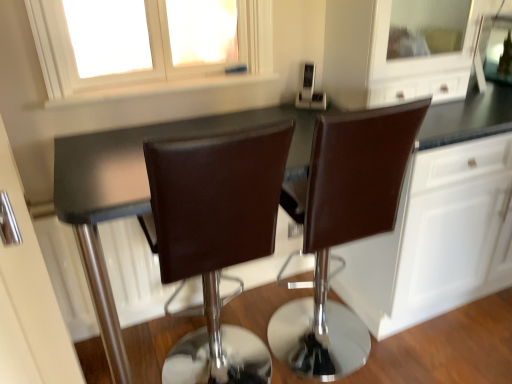
Image resolution: width=512 pixels, height=384 pixels. Find the location of `free point to the right of brown leather chair at center, positioned as the 2th chair in left-to-right order`. free point to the right of brown leather chair at center, positioned as the 2th chair in left-to-right order is located at coordinates (424, 351).